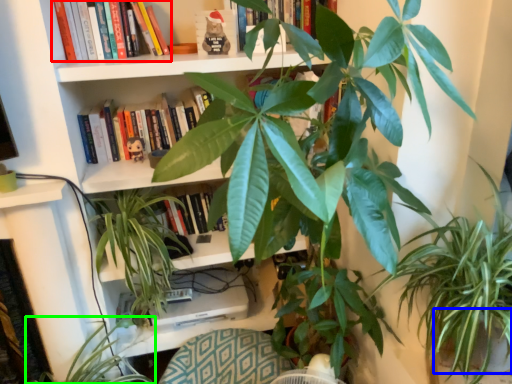
Question: Estimate the real-world distances between objects in this image. Which object is closer to book (highlighted by a red box), flowerpot (highlighted by a blue box) or houseplant (highlighted by a green box)?

Choices:
 (A) flowerpot
 (B) houseplant

Answer: (B)